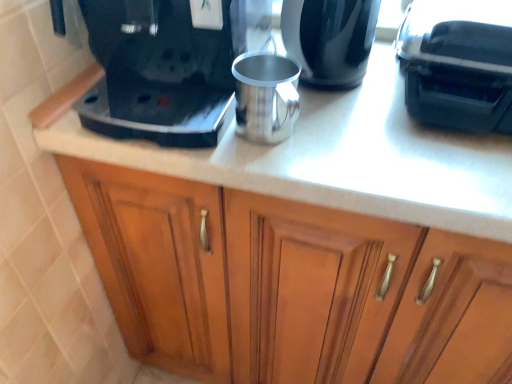
Locate an element on the screen. The width and height of the screenshot is (512, 384). vacant space underneath shiny black kettle at upper center (from a real-world perspective) is located at coordinates (341, 88).